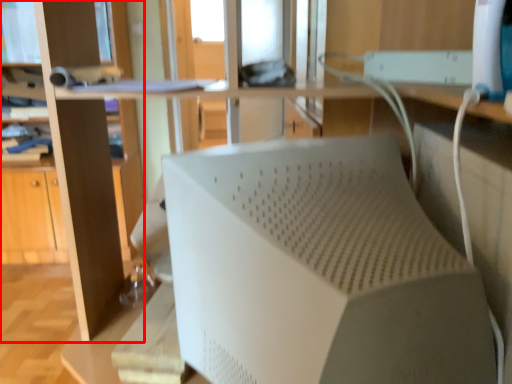
Question: From the image, what is the correct spatial relationship of bookshelf (annotated by the red box) in relation to wide?

Choices:
 (A) right
 (B) left

Answer: (B)